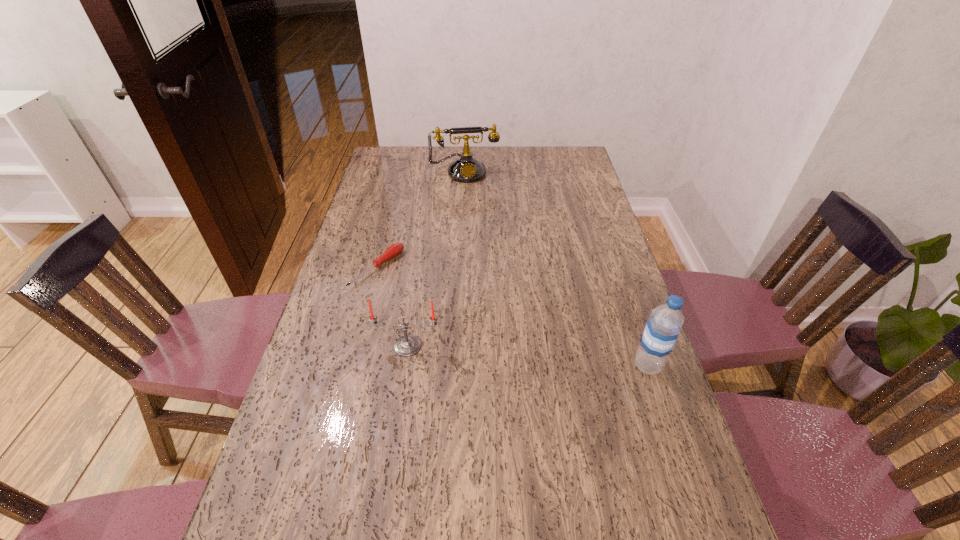
Identify the location of free point at the left edge. The width and height of the screenshot is (960, 540). (312, 490).

The width and height of the screenshot is (960, 540). I want to click on vacant space at the right edge of the desktop, so click(624, 295).

At what (x,y) coordinates should I click in order to perform the action: click on free space at the far right corner of the desktop. Please return your answer as a coordinate pair (x, y). Image resolution: width=960 pixels, height=540 pixels. Looking at the image, I should click on [x=552, y=157].

The image size is (960, 540). Identify the location of vacant area that lies between the second farthest object and the water bottle. (513, 317).

Locate an element on the screen. unoccupied area between the shortest object and the candle is located at coordinates (393, 307).

Find the location of a particular element. The width and height of the screenshot is (960, 540). blank region between the telephone and the candle is located at coordinates (436, 259).

Find the location of a particular element. unoccupied position between the telephone and the candle is located at coordinates tap(436, 259).

The image size is (960, 540). Find the location of `free area in between the candle and the telephone`. free area in between the candle and the telephone is located at coordinates (436, 259).

At what (x,y) coordinates should I click in order to perform the action: click on empty space that is in between the screwdriver and the telephone. Please return your answer as a coordinate pair (x, y). This screenshot has height=540, width=960. Looking at the image, I should click on (421, 220).

Find the location of a particular element. empty location between the shortest object and the telephone is located at coordinates (421, 220).